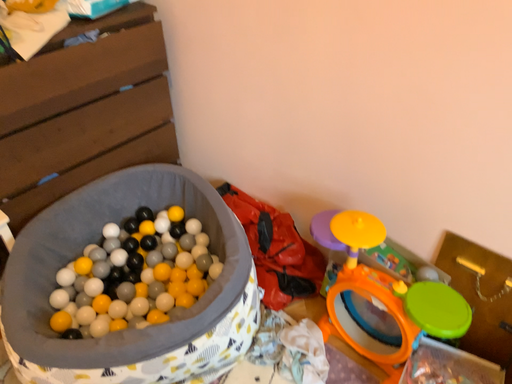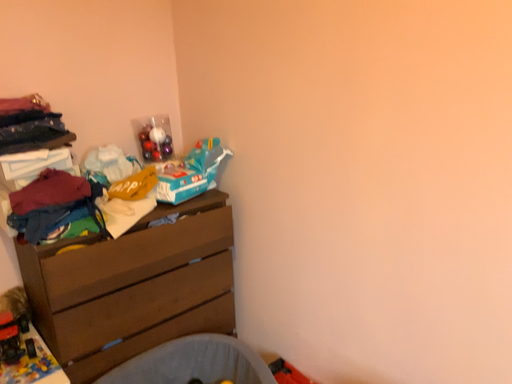
Question: Which way did the camera rotate in the video?

Choices:
 (A) rotated right
 (B) rotated left

Answer: (B)